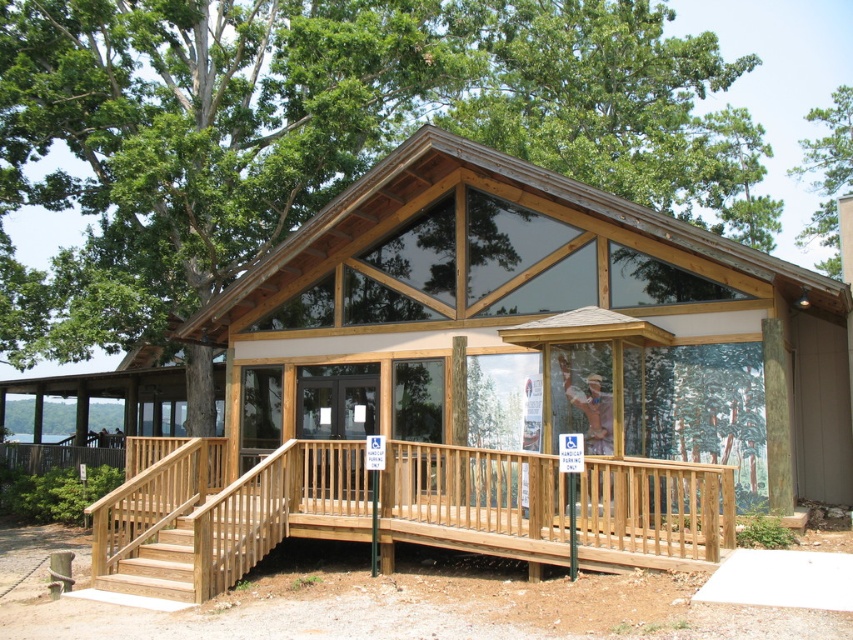
Can you confirm if natural wood cabin at center is positioned to the left of green leafy tree at upper right?

Correct, you'll find natural wood cabin at center to the left of green leafy tree at upper right.

Is natural wood cabin at center smaller than green leafy tree at upper right?

Yes.

In order to click on natural wood cabin at center in this screenshot , I will do `click(538, 324)`.

Which is behind, point (782, 474) or point (258, 470)?

Positioned behind is point (258, 470).

Is natural wood cabin at center taller than wooden ramp at lower left?

No.

Is point (491, 196) positioned behind point (666, 538)?

Yes, it is behind point (666, 538).

Where is `natural wood cabin at center`? natural wood cabin at center is located at coordinates (538, 324).

Is wooden ramp at lower left positioned at the back of green leafy tree at upper right?

No, it is in front of green leafy tree at upper right.

Which is more to the left, wooden ramp at lower left or green leafy tree at upper right?

wooden ramp at lower left

What do you see at coordinates (225, 515) in the screenshot? This screenshot has height=640, width=853. I see `wooden ramp at lower left` at bounding box center [225, 515].

This screenshot has width=853, height=640. I want to click on wooden ramp at lower left, so click(225, 515).